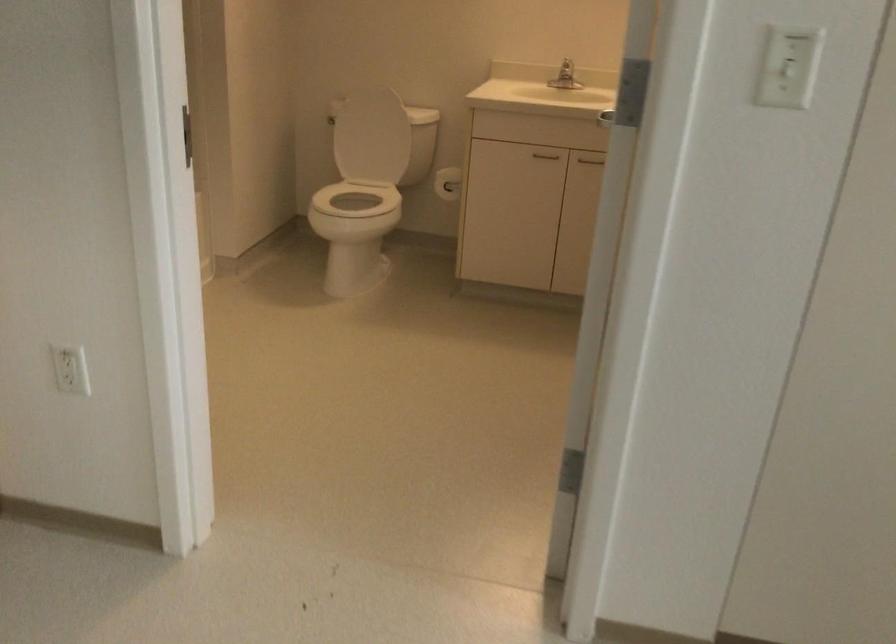
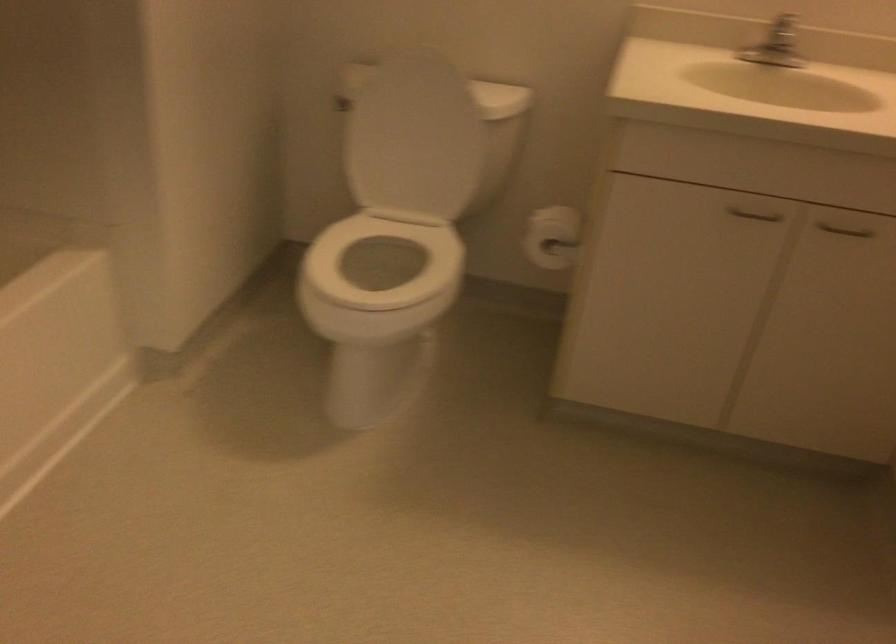
Where in the second image is the point corresponding to (572,80) from the first image?

(778, 55)